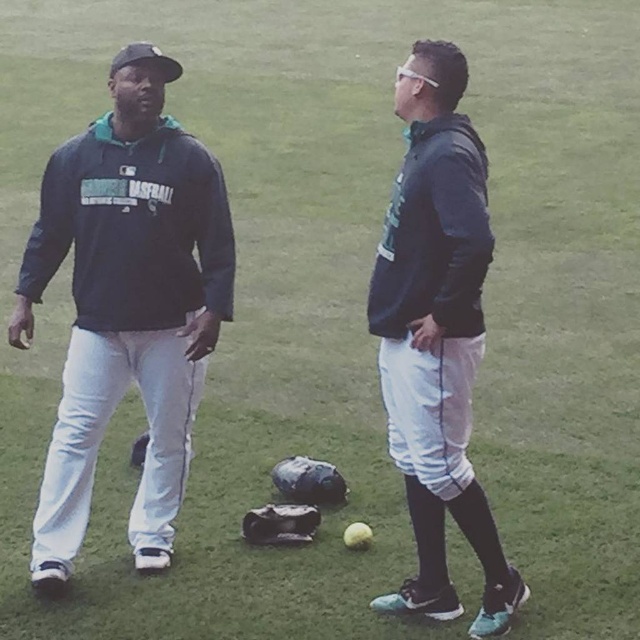
In the scene shown: You are a sports equipment inspector checking the gloves in the image. The dark gray leather glove at center needs to be at least 12 inches wide to meet safety standards. Can you determine if it meets the requirement based on the leather textured glove at center?

The dark gray leather glove at center is wider than the leather textured glove at center. However, without knowing the width of the leather textured glove at center, we cannot confirm if the dark gray leather glove at center meets the 12 inches requirement.

You are a photographer taking a picture of the two people in the scene. The matte blue hoodie at left is at coordinate point (125,301). If you want to center your camera on this point, where should you aim?

The point (125,301) indicates the location of the matte blue hoodie at left, so you should aim your camera at that coordinate to center it.